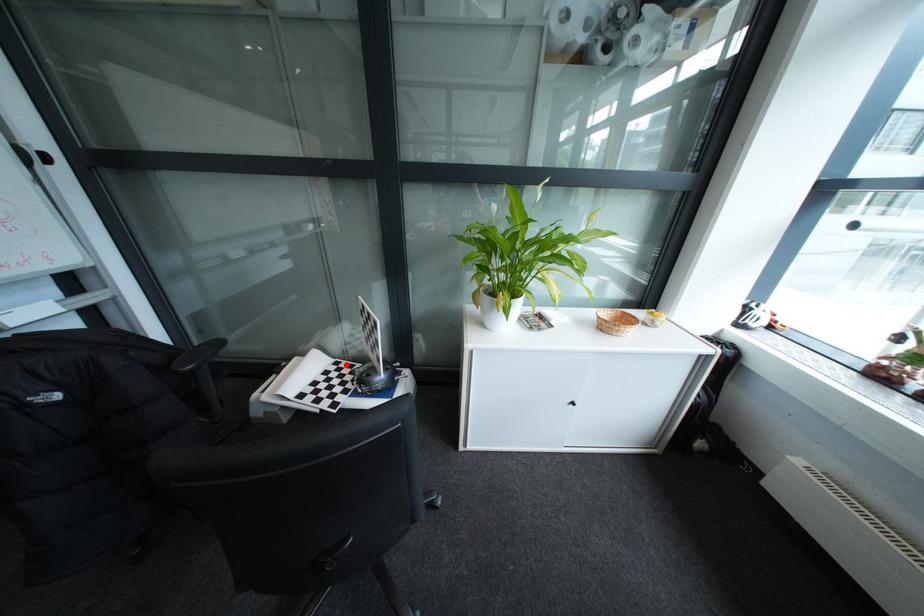
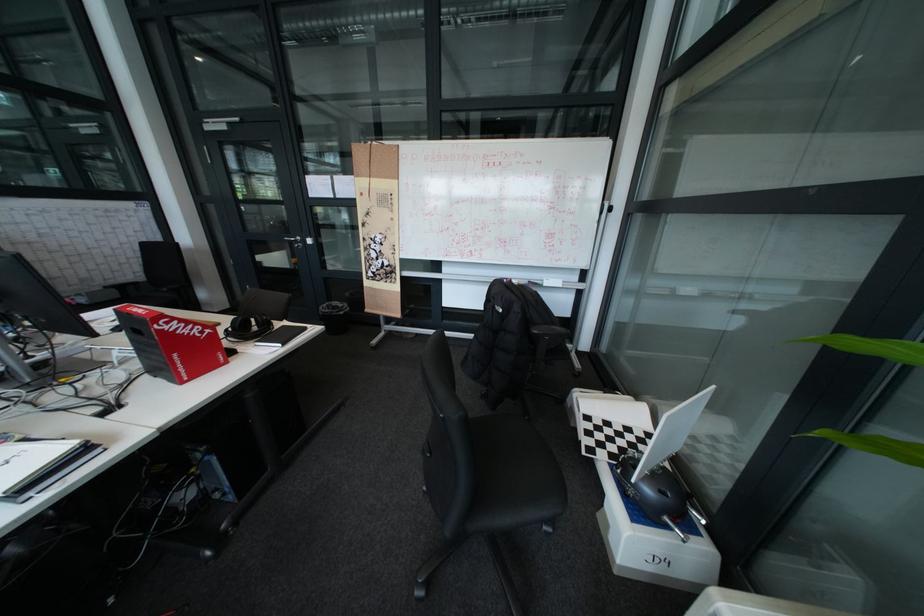
Question: I am providing you with two images of the same scene from different viewpoints. In image1, a red point is highlighted. Considering the same 3D point in image2, which of the following is correct?

Choices:
 (A) It is closer
 (B) It is farther

Answer: (A)